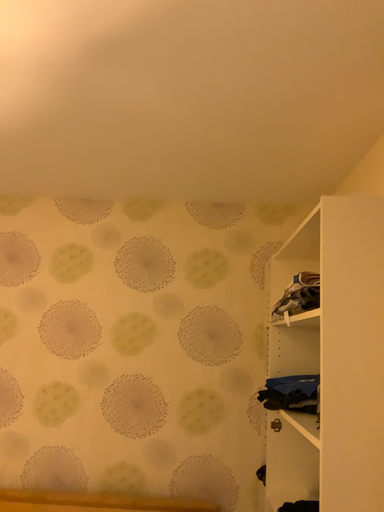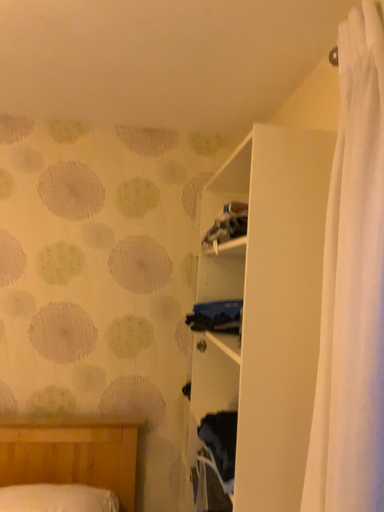
Question: Which way did the camera rotate in the video?

Choices:
 (A) rotated upward
 (B) rotated downward

Answer: (B)